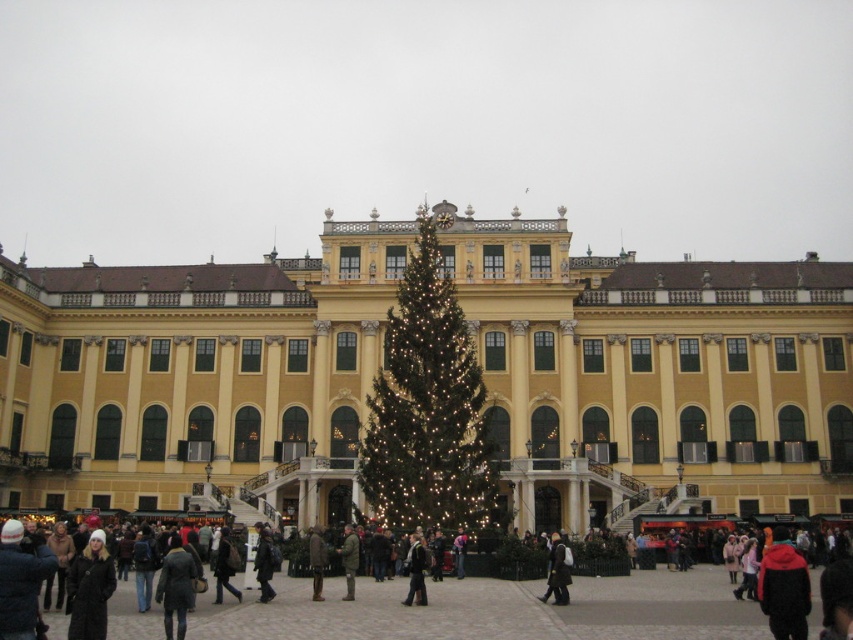
Is red fleece jacket at lower right taller than dark gray jacket at center?

Indeed, red fleece jacket at lower right has a greater height compared to dark gray jacket at center.

Is point (776, 544) less distant than point (408, 564)?

Yes, point (776, 544) is in front of point (408, 564).

Identify the location of red fleece jacket at lower right. This screenshot has width=853, height=640. point(784,588).

Between green textured christmas tree at center and brown wool coat at center, which one has less height?

Standing shorter between the two is brown wool coat at center.

Which is above, green textured christmas tree at center or brown wool coat at center?

Positioned higher is green textured christmas tree at center.

Based on the photo, who is more forward, (386, 451) or (320, 596)?

Point (320, 596) is more forward.

Identify the location of green textured christmas tree at center. (428, 406).

The height and width of the screenshot is (640, 853). I want to click on dark gray jacket at center, so click(416, 572).

You are a GUI agent. You are given a task and a screenshot of the screen. Output one action in this format:
    pyautogui.click(x=<x>, y=<y>)
    Task: Click on the dark gray jacket at center
    
    Given the screenshot: What is the action you would take?
    pyautogui.click(x=416, y=572)

Find the location of a particular element. This screenshot has width=853, height=640. dark gray jacket at center is located at coordinates (416, 572).